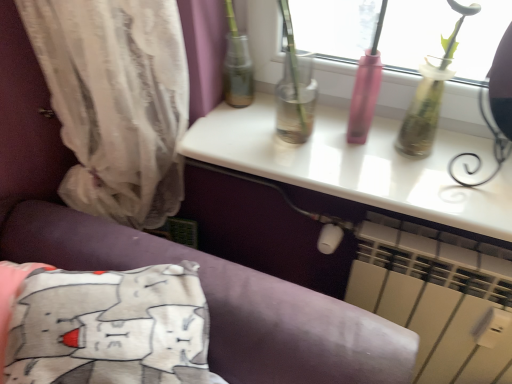
Image resolution: width=512 pixels, height=384 pixels. What are the coordinates of `free point above white glossy table at upper center (from a real-world perspective)` in the screenshot? It's located at (346, 144).